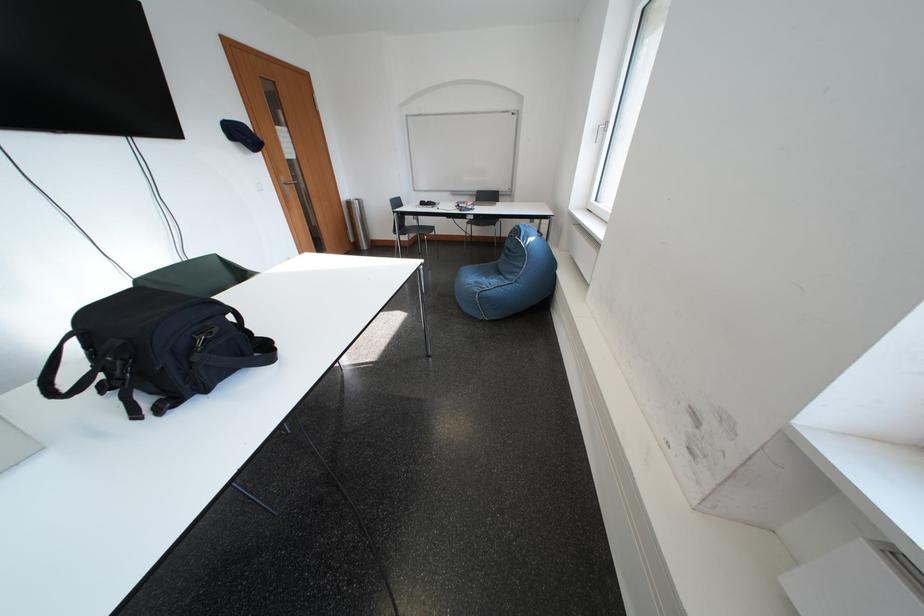
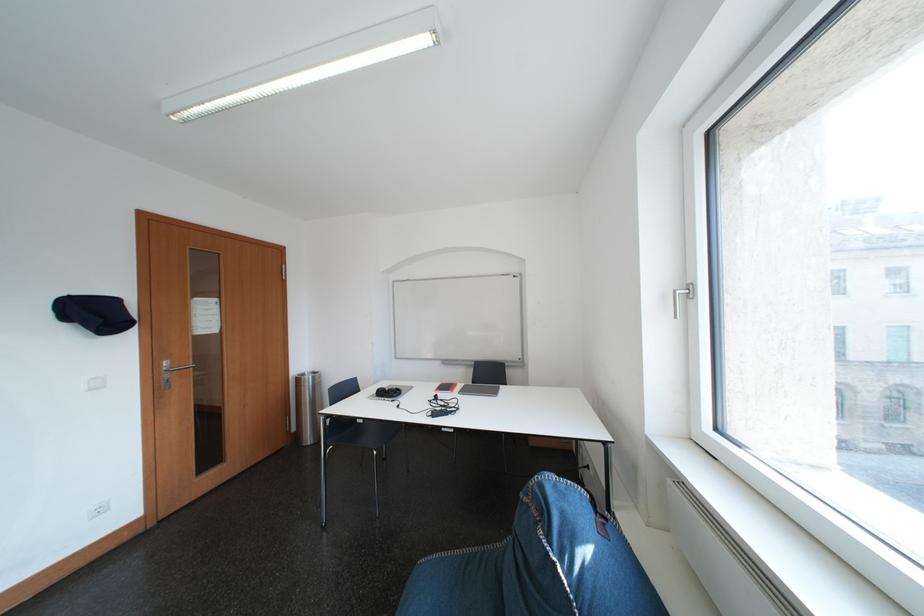
The point at (360, 207) is marked in the first image. Where is the corresponding point in the second image?

(310, 383)